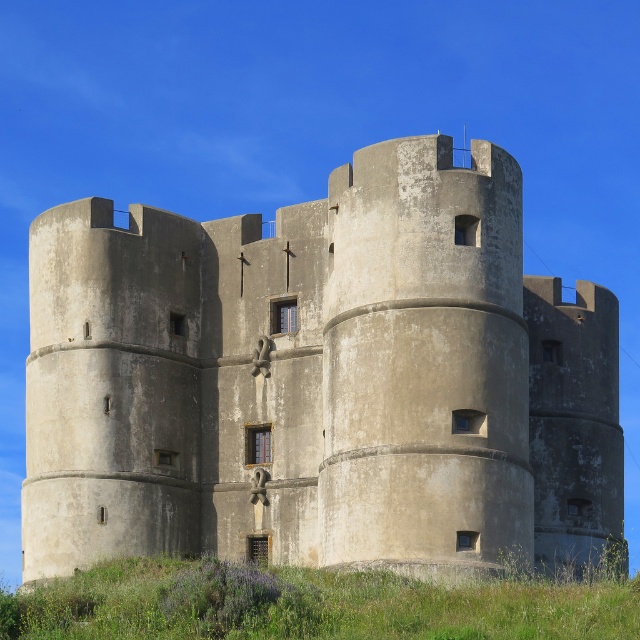
In the scene shown: You are a tourist standing in front of the beige stone castle at center. You want to take a photo that captures the entire structure. Considering the distance between you and the castle, is it possible to capture the entire castle in one frame without moving your position?

The distance between you and the beige stone castle at center is 188.57 feet. At this distance, it should be possible to capture the entire castle in one frame without needing to move, as most cameras have a wide enough angle to accommodate such a view when the subject is sufficiently far away.

You are a drone operator tasked with capturing aerial footage of the historic stone castle. You need to fly your drone from the point at coordinate point at (252,516) to a second point that is 70.63 meters away. Given the castle is surrounded by a moat, can you confirm if the drone can safely navigate this distance without crossing the moat?

The two points are 70.63 meters apart, so the drone can safely navigate this distance as it doesn not require crossing the moat.